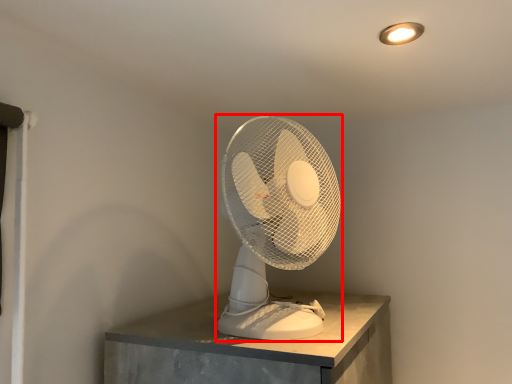
Question: From the image's perspective, where is mechanical fan (annotated by the red box) located relative to lamp?

Choices:
 (A) below
 (B) above

Answer: (A)